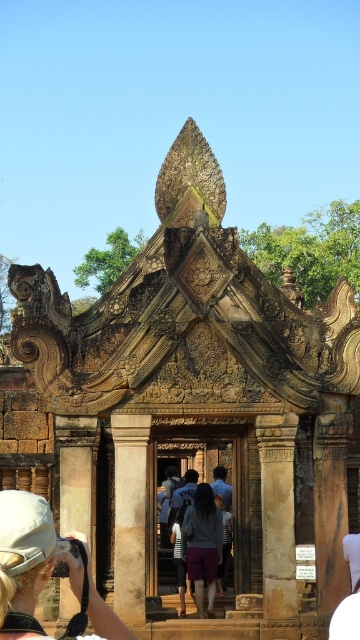
You are an archaeologist standing at the base of the ancient temple structure. You need to reach the purple cotton shorts at center to examine them, but you must avoid touching the brown stone pillar at center. Given that the pillar is 16.03 meters away from the shorts, can you safely walk in a straight line from your current position to the shorts without coming into contact with the pillar?

The brown stone pillar at center is 16.03 meters away from the purple cotton shorts at center. Since the distance between them is significant, you can safely walk in a straight line from your current position to the purple cotton shorts at center without touching the brown stone pillar at center.

You are a tourist standing in front of the ancient temple structure. You notice the brown stone column at center and the purple cotton shorts at center. Which object is positioned higher from the ground?

The brown stone column at center is located above the purple cotton shorts at center, so it is positioned higher from the ground.

You are a photographer standing at the base of the ancient temple structure. You want to take a photo of the dark gray fabric skirt at center. Considering the distance between you and the skirt, can you capture the entire structure in one shot without moving your position?

The distance between you and the dark gray fabric skirt at center is 336.01 feet, so you can capture the entire structure in one shot without moving your position because the distance is sufficient for a wide enough angle.